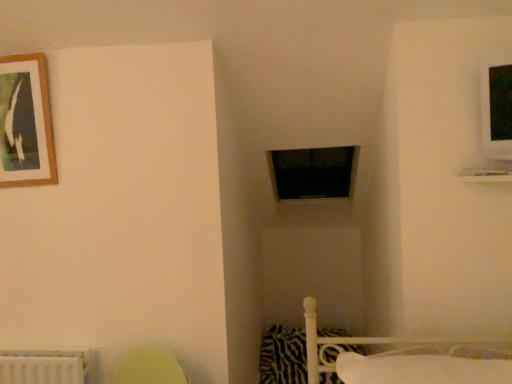
Question: Considering the positions of point (307, 372) and point (313, 193), is point (307, 372) closer or farther from the camera than point (313, 193)?

Choices:
 (A) farther
 (B) closer

Answer: (B)

Question: Is zebra-patterned fabric pillow at lower right, positioned as the 1th pillow in back-to-front order, taller or shorter than black matte window frame at center?

Choices:
 (A) short
 (B) tall

Answer: (A)

Question: Which object is the farthest from the white soft pillow at lower right, which is the second pillow in back-to-front order?

Choices:
 (A) wooden-framed picture at upper left
 (B) black matte window frame at center
 (C) zebra-patterned fabric pillow at lower right, positioned as the 1th pillow in back-to-front order

Answer: (B)

Question: Based on their relative distances, which object is nearer to the wooden-framed picture at upper left?

Choices:
 (A) black matte window frame at center
 (B) zebra-patterned fabric pillow at lower right, which is the 2th pillow from front to back
 (C) white soft pillow at lower right, which is the 1th pillow from top to bottom

Answer: (C)